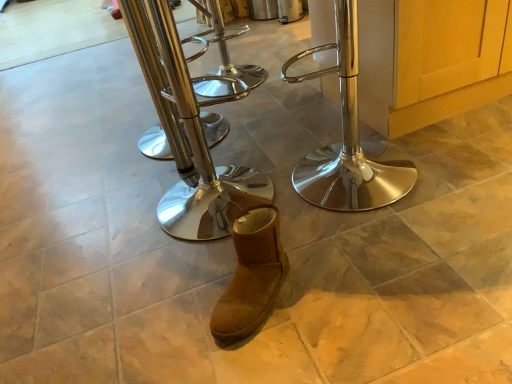
Locate an element on the screen. The width and height of the screenshot is (512, 384). unoccupied region to the right of polished metal bar stool at center, which is the 1th step stool from left to right is located at coordinates (257, 126).